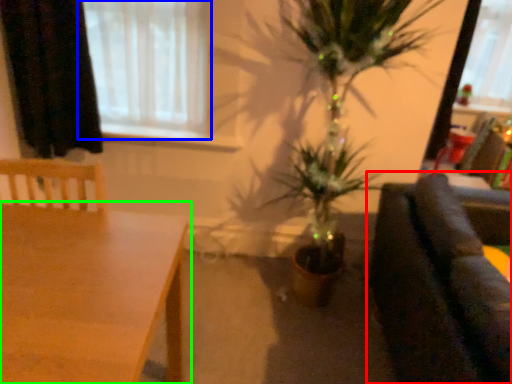
Question: Which object is positioned farthest from studio couch (highlighted by a red box)? Select from window (highlighted by a blue box) and table (highlighted by a green box).

Choices:
 (A) window
 (B) table

Answer: (A)